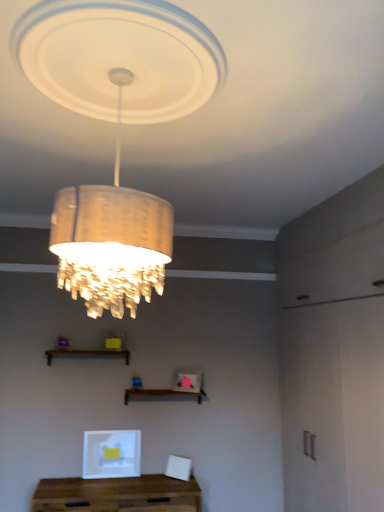
Identify the location of matte gold chandelier at upper center. The image size is (384, 512). click(x=119, y=58).

Which is correct: brown wooden shelf at center, the second shelf from the left, is inside wooden table at lower center, or outside of it?

brown wooden shelf at center, the second shelf from the left, lies outside wooden table at lower center.

Based on their positions, is brown wooden shelf at center, the 1th shelf when ordered from right to left, located to the left or right of wooden table at lower center?

brown wooden shelf at center, the 1th shelf when ordered from right to left, is positioned on wooden table at lower center's right side.

Could you tell me if brown wooden shelf at center, the second shelf from the left, is turned towards wooden table at lower center?

No, brown wooden shelf at center, the second shelf from the left, is not turned towards wooden table at lower center.

From a real-world perspective, is brown wooden shelf at center, the 1th shelf when ordered from right to left, beneath wooden table at lower center?

No, from a real-world perspective, brown wooden shelf at center, the 1th shelf when ordered from right to left, is not beneath wooden table at lower center.

What are the coordinates of `table behind the matte gold chandelier at upper center` in the screenshot? It's located at (117, 494).

From the image's perspective, is matte gold chandelier at upper center above or below wooden table at lower center?

matte gold chandelier at upper center is above wooden table at lower center.

Between matte gold chandelier at upper center and wooden table at lower center, which one has smaller size?

wooden table at lower center is smaller.

Consider the image. Which object is closer to the camera, matte gold chandelier at upper center or wooden table at lower center?

Positioned in front is matte gold chandelier at upper center.

From the image's perspective, does brown wooden shelf at center, the 1th shelf when ordered from right to left, appear higher than matte gold chandelier at upper center?

No.

Could you tell me if brown wooden shelf at center, the 1th shelf when ordered from right to left, is turned towards matte gold chandelier at upper center?

No.

Are brown wooden shelf at center, marked as the 1th shelf in a bottom-to-top arrangement, and matte gold chandelier at upper center located far from each other?

That's right, there is a large distance between brown wooden shelf at center, marked as the 1th shelf in a bottom-to-top arrangement, and matte gold chandelier at upper center.

Does brown wooden shelf at center, marked as the 1th shelf in a bottom-to-top arrangement, have a smaller size compared to matte gold chandelier at upper center?

Yes, brown wooden shelf at center, marked as the 1th shelf in a bottom-to-top arrangement, is smaller than matte gold chandelier at upper center.

From a real-world perspective, is wooden shelf at lower center, the 2th shelf when ordered from bottom to top, positioned under wooden table at lower center based on gravity?

Incorrect, from a real-world perspective, wooden shelf at lower center, the 2th shelf when ordered from bottom to top, is higher than wooden table at lower center.

Does point (115, 355) come behind point (61, 501)?

Yes, it is.

From the image's perspective, which object appears higher, wooden shelf at lower center, acting as the 1th shelf starting from the top, or wooden table at lower center?

From the image's view, wooden shelf at lower center, acting as the 1th shelf starting from the top, is above.

Considering the relative sizes of wooden shelf at lower center, acting as the 1th shelf starting from the top, and wooden table at lower center in the image provided, is wooden shelf at lower center, acting as the 1th shelf starting from the top, smaller than wooden table at lower center?

Indeed, wooden shelf at lower center, acting as the 1th shelf starting from the top, has a smaller size compared to wooden table at lower center.

Does wooden shelf at lower center, acting as the 1th shelf starting from the top, turn towards matte gold chandelier at upper center?

No, wooden shelf at lower center, acting as the 1th shelf starting from the top, is not turned towards matte gold chandelier at upper center.

Looking at this image, can you tell me how much wooden shelf at lower center, the 2th shelf positioned from the right, and matte gold chandelier at upper center differ in facing direction?

91 degrees.

Consider the image. From a real-world perspective, which is physically above, wooden shelf at lower center, the 2th shelf when ordered from bottom to top, or matte gold chandelier at upper center?

matte gold chandelier at upper center, from a real-world perspective.

Which object is closer to the camera, wooden shelf at lower center, acting as the 1th shelf starting from the top, or matte gold chandelier at upper center?

matte gold chandelier at upper center is more forward.

Does wooden table at lower center come in front of wooden shelf at lower center, positioned as the 1th shelf in left-to-right order?

Yes, wooden table at lower center is closer to the camera.

Which of these two, wooden table at lower center or wooden shelf at lower center, the 2th shelf when ordered from bottom to top, is thinner?

wooden shelf at lower center, the 2th shelf when ordered from bottom to top, is thinner.

Is wooden table at lower center touching wooden shelf at lower center, the 2th shelf when ordered from bottom to top?

No.

Is matte gold chandelier at upper center touching wooden shelf at lower center, the 2th shelf positioned from the right?

No, matte gold chandelier at upper center is not with wooden shelf at lower center, the 2th shelf positioned from the right.

From a real-world perspective, does matte gold chandelier at upper center stand above wooden shelf at lower center, the 2th shelf positioned from the right?

Yes.

Between matte gold chandelier at upper center and wooden shelf at lower center, positioned as the 1th shelf in left-to-right order, which one is positioned behind?

Positioned behind is wooden shelf at lower center, positioned as the 1th shelf in left-to-right order.

Does matte gold chandelier at upper center have a smaller size compared to wooden shelf at lower center, acting as the 1th shelf starting from the top?

Actually, matte gold chandelier at upper center might be larger than wooden shelf at lower center, acting as the 1th shelf starting from the top.

Where is `table below the brown wooden shelf at center, marked as the 1th shelf in a bottom-to-top arrangement (from the image's perspective)`? table below the brown wooden shelf at center, marked as the 1th shelf in a bottom-to-top arrangement (from the image's perspective) is located at coordinates (117, 494).

Image resolution: width=384 pixels, height=512 pixels. In order to click on lamp located above the wooden table at lower center (from the image's perspective) in this screenshot , I will do `click(119, 58)`.

Which object lies nearer to the anchor point brown wooden shelf at center, marked as the 2th shelf in a top-to-bottom arrangement, matte gold chandelier at upper center or wooden shelf at lower center, acting as the 1th shelf starting from the top?

wooden shelf at lower center, acting as the 1th shelf starting from the top.

When comparing their distances from wooden shelf at lower center, the 2th shelf positioned from the right, does wooden table at lower center or brown wooden shelf at center, the 1th shelf when ordered from right to left, seem further?

Among the two, wooden table at lower center is located further to wooden shelf at lower center, the 2th shelf positioned from the right.

When comparing their distances from matte gold chandelier at upper center, does wooden table at lower center or brown wooden shelf at center, the second shelf from the left, seem closer?

The object closer to matte gold chandelier at upper center is brown wooden shelf at center, the second shelf from the left.

Based on their spatial positions, is brown wooden shelf at center, the second shelf from the left, or matte gold chandelier at upper center further from wooden table at lower center?

Based on the image, matte gold chandelier at upper center appears to be further to wooden table at lower center.

From the image, which object appears to be nearer to wooden shelf at lower center, the 2th shelf when ordered from bottom to top, matte gold chandelier at upper center or brown wooden shelf at center, marked as the 2th shelf in a top-to-bottom arrangement?

The object closer to wooden shelf at lower center, the 2th shelf when ordered from bottom to top, is brown wooden shelf at center, marked as the 2th shelf in a top-to-bottom arrangement.

Looking at the image, which one is located further to brown wooden shelf at center, the second shelf from the left, wooden table at lower center or wooden shelf at lower center, acting as the 1th shelf starting from the top?

wooden table at lower center is positioned further to the anchor brown wooden shelf at center, the second shelf from the left.

Consider the image. Considering their positions, is brown wooden shelf at center, marked as the 1th shelf in a bottom-to-top arrangement, positioned further to matte gold chandelier at upper center than wooden shelf at lower center, the 2th shelf when ordered from bottom to top?

Based on the image, brown wooden shelf at center, marked as the 1th shelf in a bottom-to-top arrangement, appears to be further to matte gold chandelier at upper center.

Looking at the image, which one is located closer to matte gold chandelier at upper center, wooden shelf at lower center, acting as the 1th shelf starting from the top, or brown wooden shelf at center, marked as the 1th shelf in a bottom-to-top arrangement?

wooden shelf at lower center, acting as the 1th shelf starting from the top, is positioned closer to the anchor matte gold chandelier at upper center.

Identify the location of shelf between wooden shelf at lower center, the 2th shelf when ordered from bottom to top, and wooden table at lower center in the up-down direction. (161, 394).

Find the location of a particular element. The image size is (384, 512). table between matte gold chandelier at upper center and brown wooden shelf at center, the 1th shelf when ordered from right to left, in the front-back direction is located at coordinates (117, 494).

Where is `shelf located between matte gold chandelier at upper center and brown wooden shelf at center, the 1th shelf when ordered from right to left, in the depth direction`? shelf located between matte gold chandelier at upper center and brown wooden shelf at center, the 1th shelf when ordered from right to left, in the depth direction is located at coordinates (87, 354).

Find the location of a particular element. This screenshot has height=512, width=384. table located between matte gold chandelier at upper center and wooden shelf at lower center, the 2th shelf positioned from the right, in the depth direction is located at coordinates pyautogui.click(x=117, y=494).